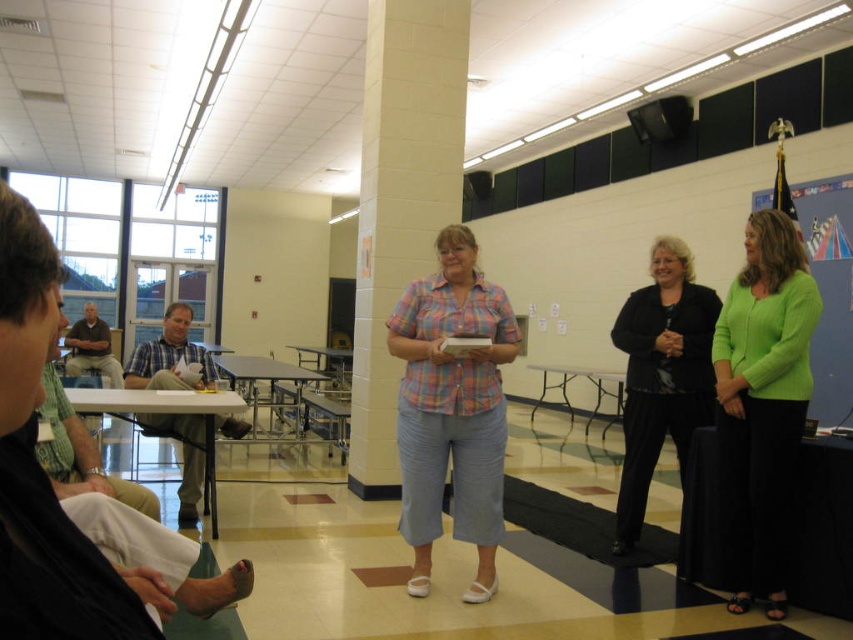
Can you confirm if black matte blazer at center is positioned below brown cotton shirt at left?

Indeed, black matte blazer at center is positioned under brown cotton shirt at left.

Who is more forward, (650,301) or (96,323)?

Point (650,301)

Locate an element on the screen. This screenshot has width=853, height=640. black matte blazer at center is located at coordinates (660, 374).

Based on the photo, does white brick pillar at center appear over plaid fabric shirt at center?

Indeed, white brick pillar at center is positioned over plaid fabric shirt at center.

What do you see at coordinates (399, 200) in the screenshot? I see `white brick pillar at center` at bounding box center [399, 200].

Find the location of a particular element. white brick pillar at center is located at coordinates (399, 200).

Find the location of `white brick pillar at center`. white brick pillar at center is located at coordinates (399, 200).

Locate an element on the screen. white brick pillar at center is located at coordinates (399, 200).

I want to click on white brick pillar at center, so click(399, 200).